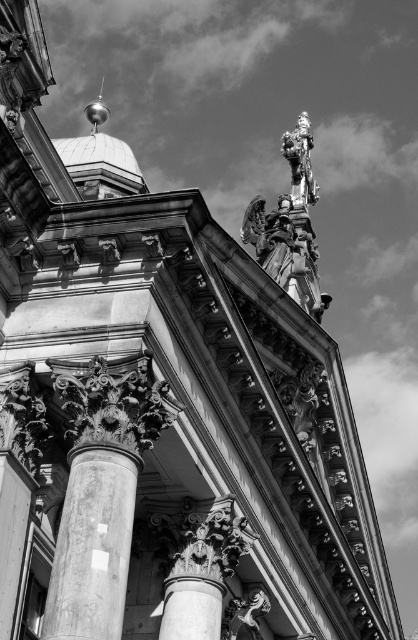
Based on the scene description, where is the marble column at center located in terms of its 2D coordinates?

The marble column at center is located at the 2D coordinates of point (92,545).

Consider the image. You are an architect designing a scale model of this structure. You need to ensure that the marble column at center and the white glossy dome at center are proportionally accurate. Based on the given information, which object should you make narrower in your model?

The marble column at center should be made narrower in the model since it has a lesser width compared to the white glossy dome at center according to the description.